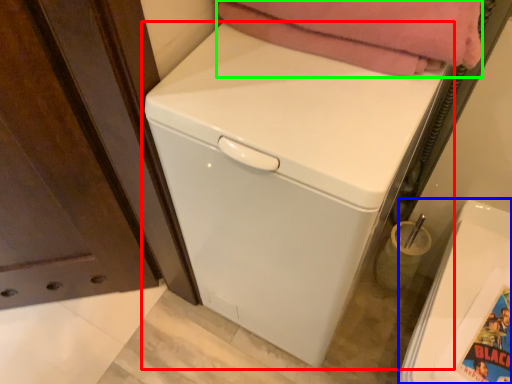
Question: Which object is the farthest from washing machine (highlighted by a red box)? Choose among these: washing machine (highlighted by a blue box) or blanket (highlighted by a green box).

Choices:
 (A) washing machine
 (B) blanket

Answer: (A)